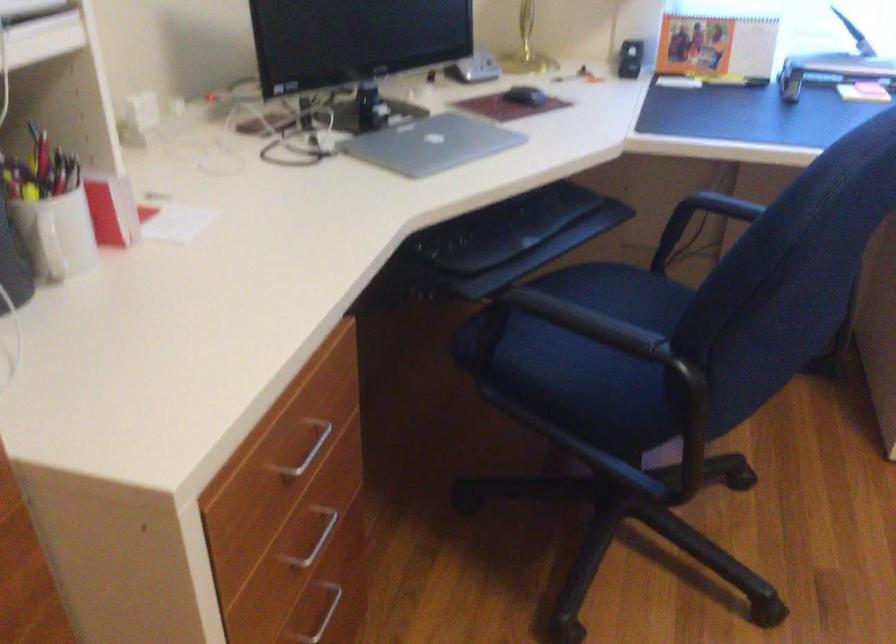
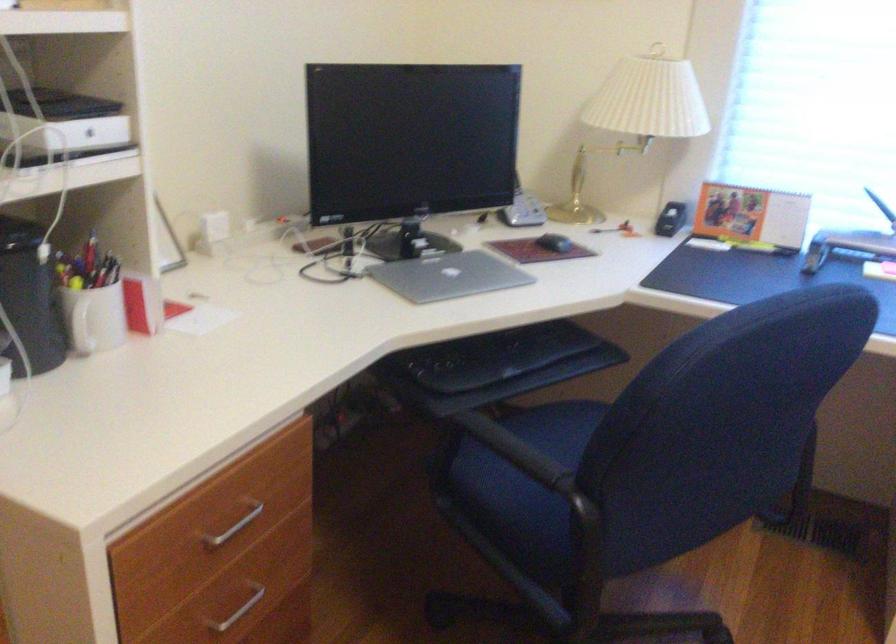
Find the pixel in the second image that matches the point at 814,73 in the first image.

(847, 245)